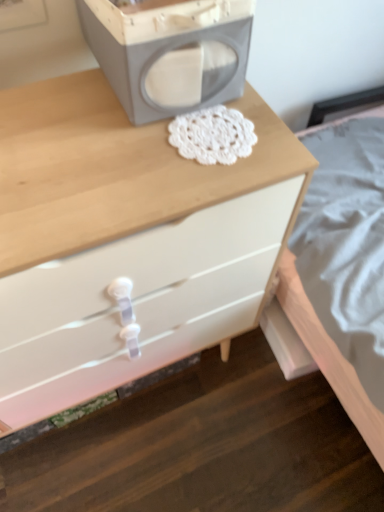
Question: Is white glossy chest of drawers at center located within matte gray speaker at upper center?

Choices:
 (A) yes
 (B) no

Answer: (B)

Question: Is matte gray speaker at upper center facing towards white glossy chest of drawers at center?

Choices:
 (A) yes
 (B) no

Answer: (B)

Question: Can you confirm if matte gray speaker at upper center is positioned to the right of white glossy chest of drawers at center?

Choices:
 (A) yes
 (B) no

Answer: (A)

Question: From a real-world perspective, does matte gray speaker at upper center sit lower than white glossy chest of drawers at center?

Choices:
 (A) no
 (B) yes

Answer: (A)

Question: Can you confirm if matte gray speaker at upper center is positioned to the left of white glossy chest of drawers at center?

Choices:
 (A) no
 (B) yes

Answer: (A)

Question: Is matte gray speaker at upper center far from white glossy chest of drawers at center?

Choices:
 (A) no
 (B) yes

Answer: (A)

Question: Is white glossy chest of drawers at center aimed at matte gray speaker at upper center?

Choices:
 (A) yes
 (B) no

Answer: (B)

Question: Is white glossy chest of drawers at center to the left of matte gray speaker at upper center from the viewer's perspective?

Choices:
 (A) yes
 (B) no

Answer: (A)

Question: Is white glossy chest of drawers at center taller than matte gray speaker at upper center?

Choices:
 (A) yes
 (B) no

Answer: (A)

Question: Is the position of white glossy chest of drawers at center more distant than that of matte gray speaker at upper center?

Choices:
 (A) yes
 (B) no

Answer: (B)

Question: From a real-world perspective, does white glossy chest of drawers at center stand above matte gray speaker at upper center?

Choices:
 (A) yes
 (B) no

Answer: (B)

Question: Is white glossy chest of drawers at center to the right of matte gray speaker at upper center from the viewer's perspective?

Choices:
 (A) yes
 (B) no

Answer: (B)

Question: In the image, is matte gray speaker at upper center positioned in front of or behind white glossy chest of drawers at center?

Choices:
 (A) front
 (B) behind

Answer: (B)